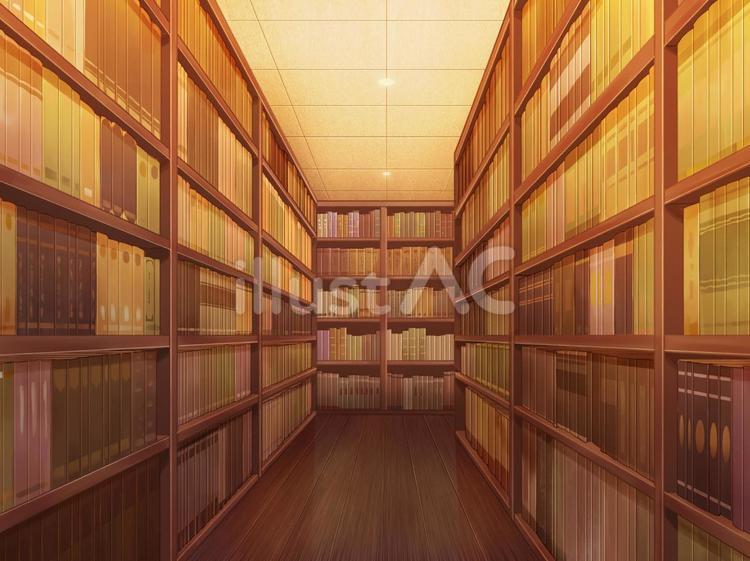
You are a GUI agent. You are given a task and a screenshot of the screen. Output one action in this format:
    pyautogui.click(x=<x>, y=<y>)
    Task: Click on the shelves with books of different height
    The height and width of the screenshot is (561, 750).
    Given the screenshot: What is the action you would take?
    (330, 223), (406, 223), (422, 298), (351, 303), (345, 344), (418, 347), (418, 388), (344, 390), (148, 295)